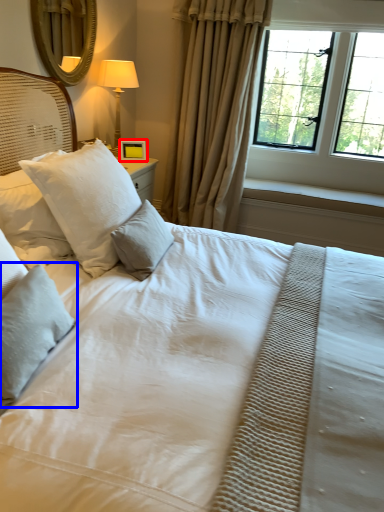
Question: Which point is closer to the camera, picture frame (highlighted by a red box) or pillow (highlighted by a blue box)?

Choices:
 (A) picture frame
 (B) pillow

Answer: (B)